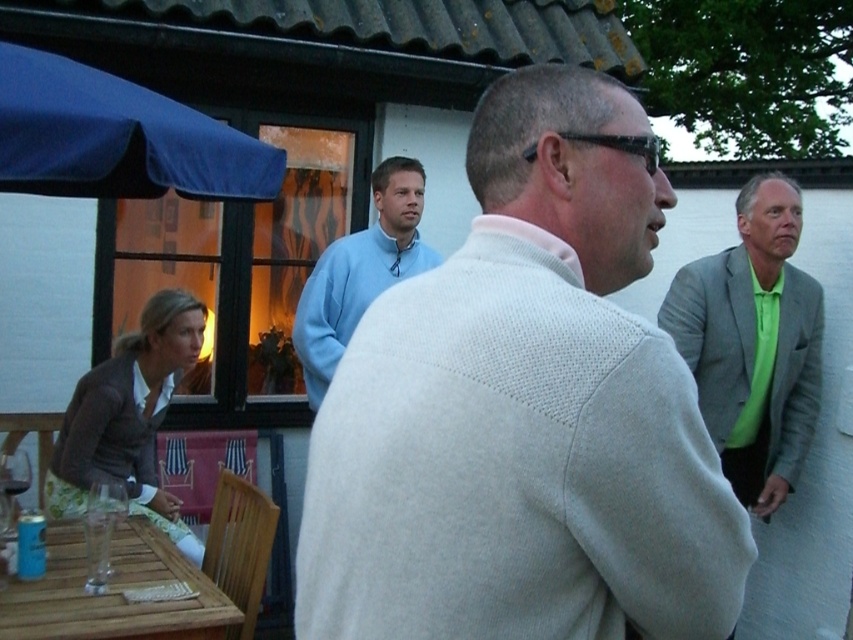
You are standing at the point with coordinates point (715, 333). What object are you standing on?

You are standing on the light gray wool sweater at right.